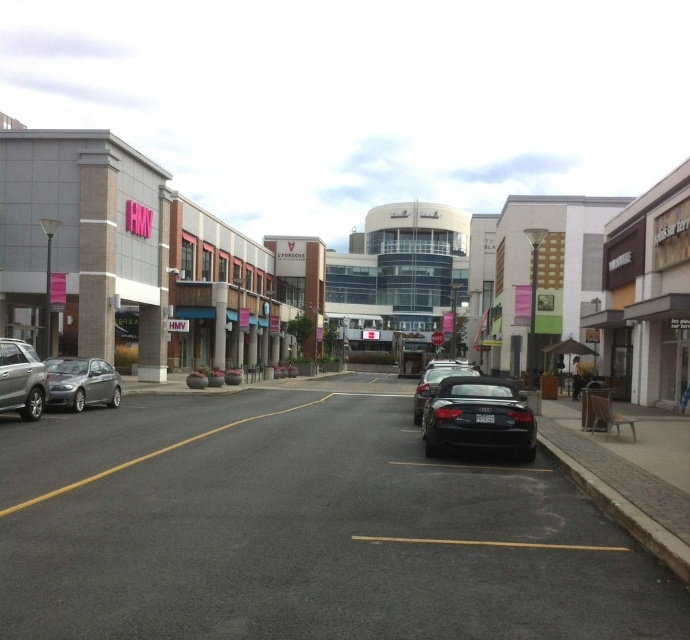
Consider the image. You are a delivery driver who needs to park your vehicle in this area. You have a van that is 4.2 meters long. The parking space next to the silver metallic sedan at left and black matte car at center is available. Can your van fit in that space?

The silver metallic sedan at left is smaller than the black matte car at center. However, without knowing the exact dimensions of the parking space, it is impossible to determine if the van will fit. Please check the parking space size before deciding.

In the scene shown: You are a delivery person trying to park your van between the silver metallic sedan at left and the black matte car at center. Your van is 2 meters wide. Can you fit your van between them?

The silver metallic sedan at left is thinner than the black matte car at center, but without knowing the exact distance between them, it is impossible to determine if the van will fit. Please check the available space between the two cars first.